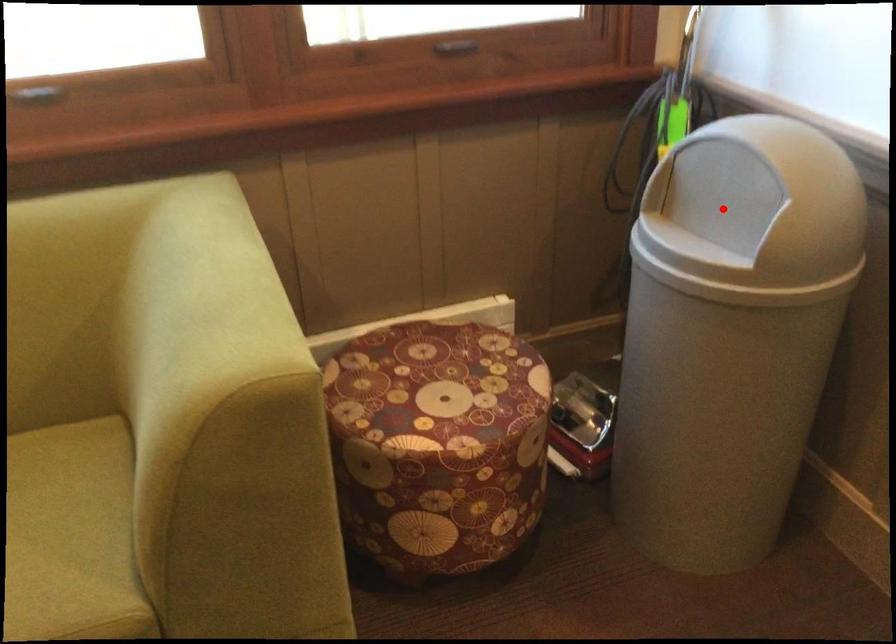
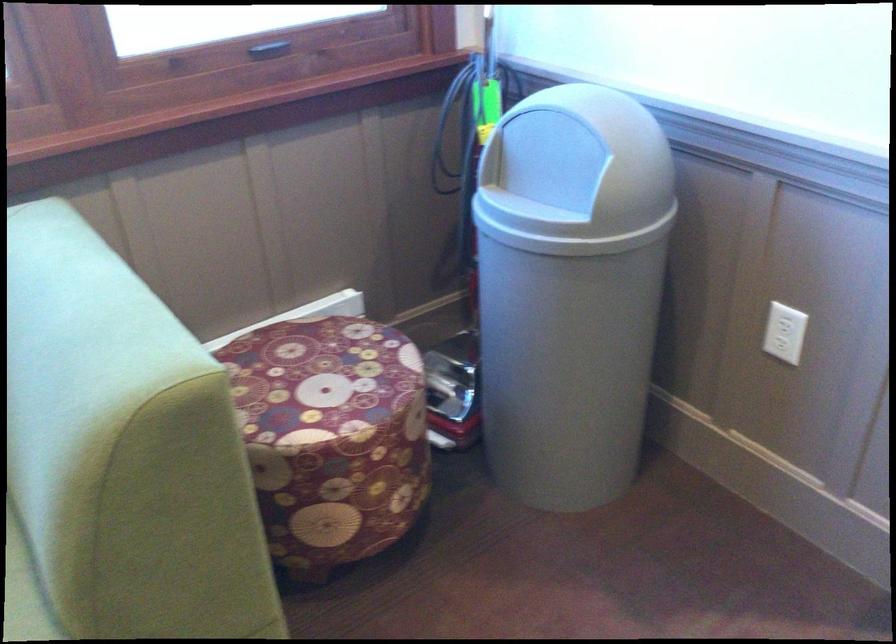
The point at the highlighted location is marked in the first image. Where is the corresponding point in the second image?

(550, 174)